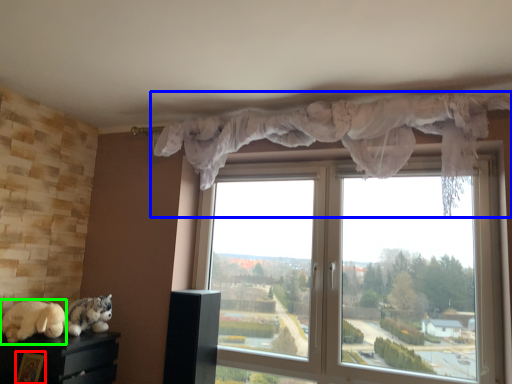
Question: Which is nearer to the picture frame (highlighted by a red box)? curtain (highlighted by a blue box) or animal (highlighted by a green box).

Choices:
 (A) curtain
 (B) animal

Answer: (B)